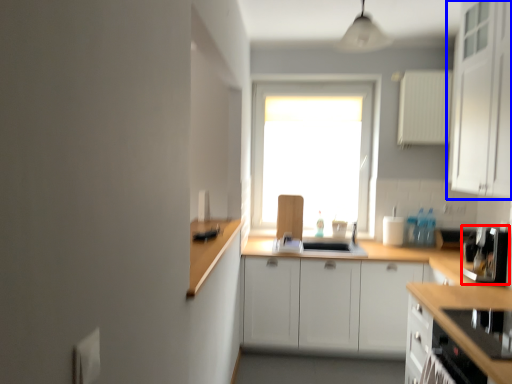
Question: Which object is closer to the camera taking this photo, coffee machine (highlighted by a red box) or cabinetry (highlighted by a blue box)?

Choices:
 (A) coffee machine
 (B) cabinetry

Answer: (B)